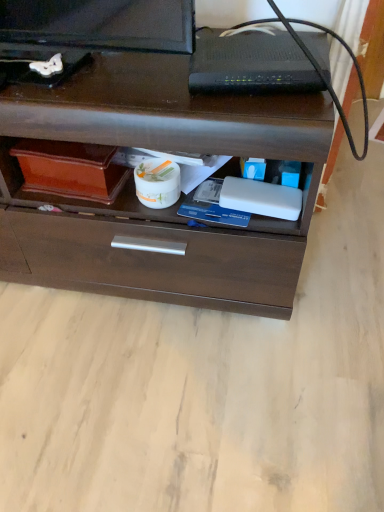
Question: From the image's perspective, is brown wood chest of drawers at center over black plastic router at upper center?

Choices:
 (A) yes
 (B) no

Answer: (B)

Question: Does brown wood chest of drawers at center have a greater height compared to black plastic router at upper center?

Choices:
 (A) no
 (B) yes

Answer: (B)

Question: From a real-world perspective, does brown wood chest of drawers at center sit lower than black plastic router at upper center?

Choices:
 (A) no
 (B) yes

Answer: (B)

Question: Can you confirm if brown wood chest of drawers at center is positioned to the left of black plastic router at upper center?

Choices:
 (A) no
 (B) yes

Answer: (B)

Question: From a real-world perspective, is brown wood chest of drawers at center positioned over black plastic router at upper center based on gravity?

Choices:
 (A) no
 (B) yes

Answer: (A)

Question: Is black plastic router at upper center at the back of brown wood chest of drawers at center?

Choices:
 (A) yes
 (B) no

Answer: (B)

Question: Is brown wood chest of drawers at center completely or partially inside black plastic router at upper center?

Choices:
 (A) no
 (B) yes

Answer: (A)

Question: Considering the relative sizes of black plastic router at upper center and brown wood chest of drawers at center in the image provided, is black plastic router at upper center shorter than brown wood chest of drawers at center?

Choices:
 (A) yes
 (B) no

Answer: (A)

Question: Does black plastic router at upper center appear on the left side of brown wood chest of drawers at center?

Choices:
 (A) yes
 (B) no

Answer: (B)

Question: Is black plastic router at upper center facing towards brown wood chest of drawers at center?

Choices:
 (A) yes
 (B) no

Answer: (B)

Question: Does black plastic router at upper center have a lesser width compared to brown wood chest of drawers at center?

Choices:
 (A) no
 (B) yes

Answer: (B)

Question: From the image's perspective, is black plastic router at upper center beneath brown wood chest of drawers at center?

Choices:
 (A) no
 (B) yes

Answer: (A)

Question: Visually, is brown wood chest of drawers at center positioned to the left or to the right of black plastic router at upper center?

Choices:
 (A) left
 (B) right

Answer: (A)